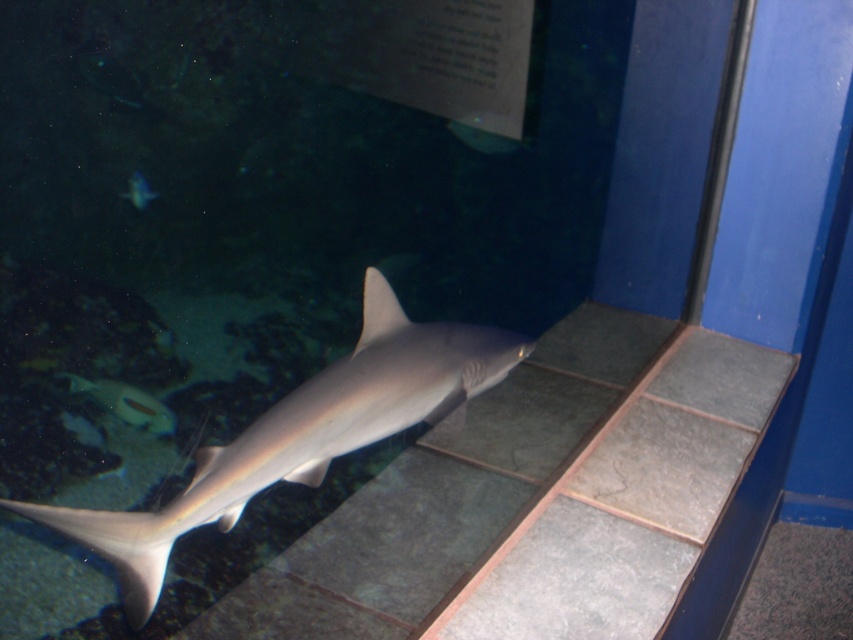
Is smooth gray shark at center thinner than gray matte fin at center?

No, smooth gray shark at center is not thinner than gray matte fin at center.

Find the location of a particular element. smooth gray shark at center is located at coordinates (296, 444).

Can you confirm if shiny silver fish at lower left is positioned to the left of gray matte fin at center?

Correct, you'll find shiny silver fish at lower left to the left of gray matte fin at center.

Which is above, shiny silver fish at lower left or gray matte fin at center?

gray matte fin at center is higher up.

Image resolution: width=853 pixels, height=640 pixels. In order to click on shiny silver fish at lower left in this screenshot , I will do `click(125, 403)`.

Is smooth gray shark at center further to the viewer compared to shiny silver fish at lower left?

No, it is not.

The width and height of the screenshot is (853, 640). In order to click on smooth gray shark at center in this screenshot , I will do `click(296, 444)`.